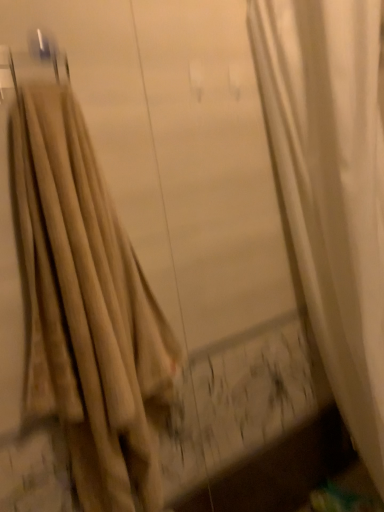
Question: From a real-world perspective, is metallic silver hanger at upper left on beige fabric curtain at left?

Choices:
 (A) no
 (B) yes

Answer: (B)

Question: From the image's perspective, is metallic silver hanger at upper left below beige fabric curtain at left?

Choices:
 (A) no
 (B) yes

Answer: (A)

Question: From a real-world perspective, does metallic silver hanger at upper left sit lower than beige fabric curtain at left?

Choices:
 (A) yes
 (B) no

Answer: (B)

Question: Can you confirm if metallic silver hanger at upper left is thinner than beige fabric curtain at left?

Choices:
 (A) no
 (B) yes

Answer: (B)

Question: Considering the relative sizes of metallic silver hanger at upper left and beige fabric curtain at left in the image provided, is metallic silver hanger at upper left wider than beige fabric curtain at left?

Choices:
 (A) yes
 (B) no

Answer: (B)

Question: Does metallic silver hanger at upper left lie in front of beige fabric curtain at left?

Choices:
 (A) no
 (B) yes

Answer: (A)

Question: Can you confirm if beige fabric curtain at left is smaller than metallic silver hanger at upper left?

Choices:
 (A) yes
 (B) no

Answer: (B)

Question: Would you say beige fabric curtain at left is a long distance from metallic silver hanger at upper left?

Choices:
 (A) no
 (B) yes

Answer: (A)

Question: Is beige fabric curtain at left with metallic silver hanger at upper left?

Choices:
 (A) yes
 (B) no

Answer: (B)

Question: Is the position of beige fabric curtain at left more distant than that of metallic silver hanger at upper left?

Choices:
 (A) yes
 (B) no

Answer: (B)

Question: From a real-world perspective, does beige fabric curtain at left stand above metallic silver hanger at upper left?

Choices:
 (A) no
 (B) yes

Answer: (A)

Question: Is beige fabric curtain at left looking in the opposite direction of metallic silver hanger at upper left?

Choices:
 (A) yes
 (B) no

Answer: (B)

Question: From a real-world perspective, is beige fabric curtain at left positioned above or below metallic silver hanger at upper left?

Choices:
 (A) below
 (B) above

Answer: (A)